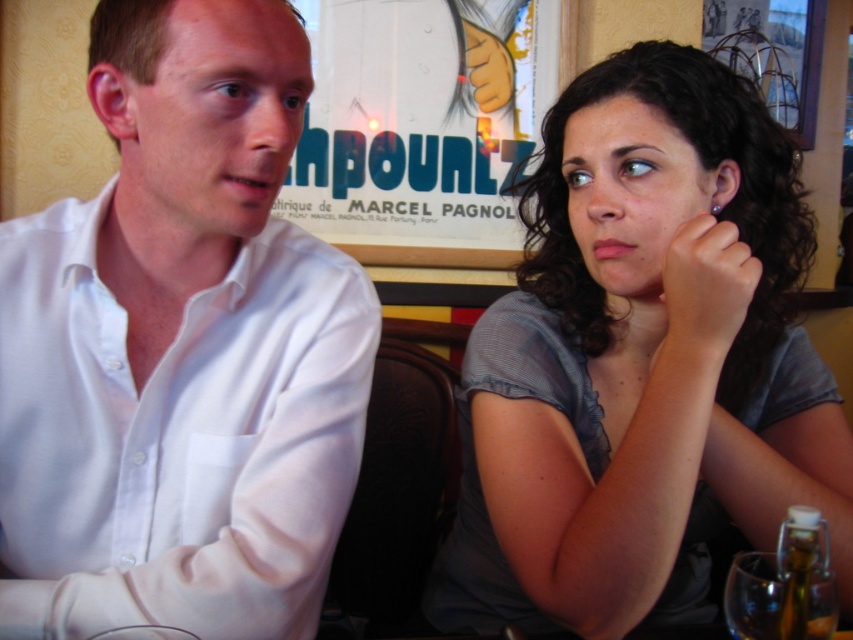
Does white smooth shirt at left have a greater width compared to gray sheer blouse at upper right?

In fact, white smooth shirt at left might be narrower than gray sheer blouse at upper right.

From the picture: Who is more forward, (x=131, y=624) or (x=578, y=435)?

Point (x=131, y=624)

This screenshot has height=640, width=853. I want to click on white smooth shirt at left, so click(181, 356).

The image size is (853, 640). I want to click on white smooth shirt at left, so click(x=181, y=356).